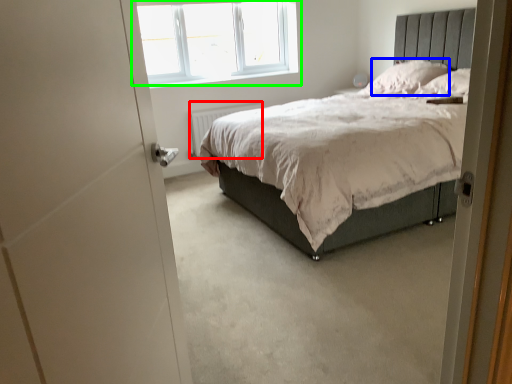
Question: Which is nearer to the radiator (highlighted by a red box)? pillow (highlighted by a blue box) or window (highlighted by a green box).

Choices:
 (A) pillow
 (B) window

Answer: (B)